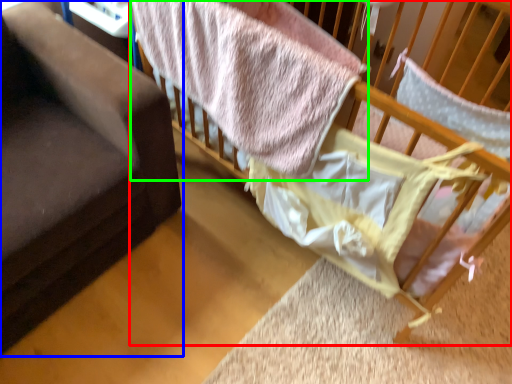
Question: Which object is the farthest from infant bed (highlighted by a red box)? Choose among these: furniture (highlighted by a blue box) or bed (highlighted by a green box).

Choices:
 (A) furniture
 (B) bed

Answer: (A)